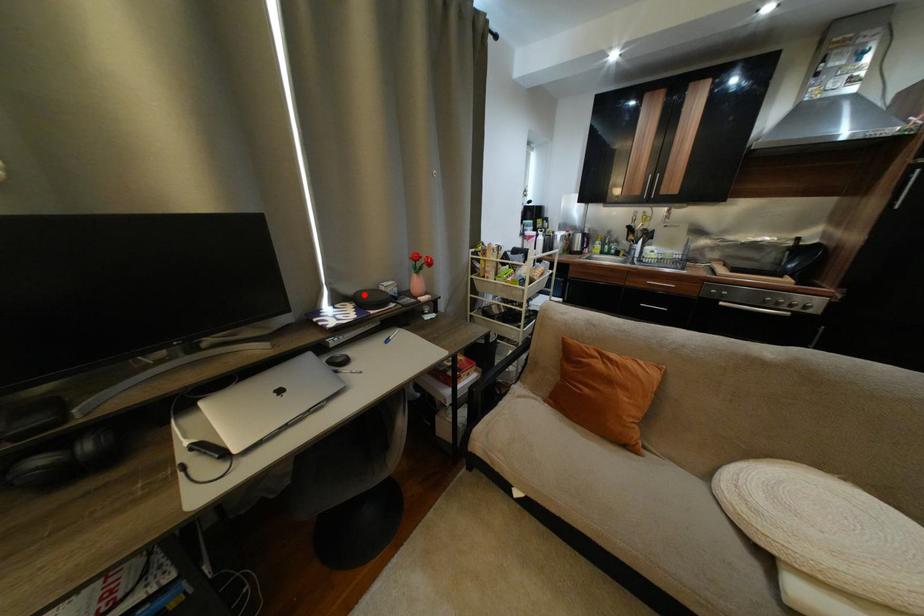
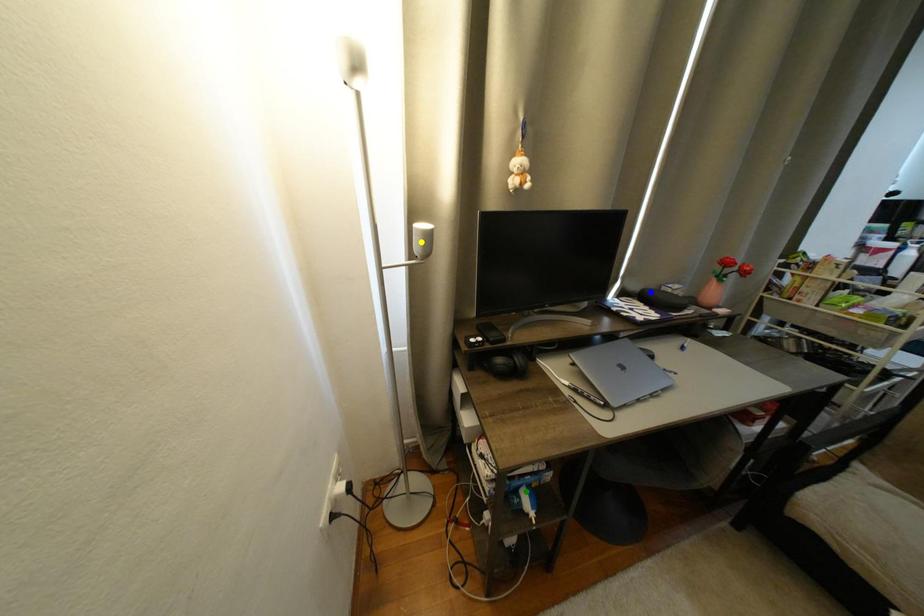
Question: I am providing you with two images of the same scene from different viewpoints. A red point is marked on the first image. You are given multiple points on the second image. Can you choose the point in image 2 that corresponds to the point in image 1?

Choices:
 (A) yellow point
 (B) blue point
 (C) green point

Answer: (B)